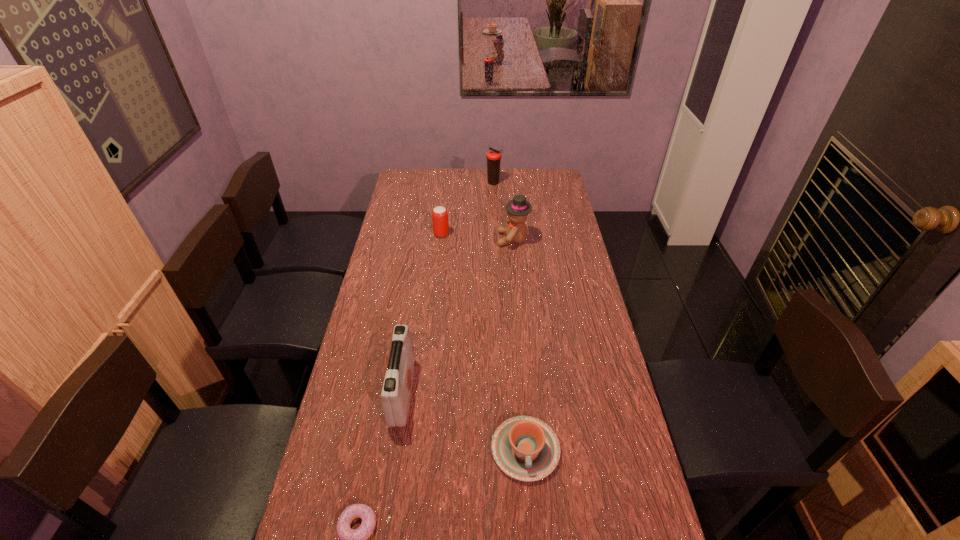
In order to click on rag_doll in this screenshot , I will do `click(518, 209)`.

You are a GUI agent. You are given a task and a screenshot of the screen. Output one action in this format:
    pyautogui.click(x=<x>, y=<y>)
    Task: Click on the farthest object
    Image resolution: width=960 pixels, height=540 pixels.
    Given the screenshot: What is the action you would take?
    pyautogui.click(x=493, y=157)

This screenshot has height=540, width=960. Identify the location of the first-aid kit. pyautogui.click(x=396, y=393).

Where is `beer can`? This screenshot has height=540, width=960. beer can is located at coordinates (439, 214).

Where is `the third shortest object`? The width and height of the screenshot is (960, 540). the third shortest object is located at coordinates (439, 214).

The image size is (960, 540). I want to click on the second shortest object, so click(525, 448).

Where is `free space located on the front-facing side of the rag_doll`? This screenshot has width=960, height=540. free space located on the front-facing side of the rag_doll is located at coordinates (409, 239).

You are a GUI agent. You are given a task and a screenshot of the screen. Output one action in this format:
    pyautogui.click(x=<x>, y=<y>)
    Task: Click on the free space located 0.240m on the front-facing side of the rag_doll
    
    Given the screenshot: What is the action you would take?
    pyautogui.click(x=442, y=239)

Locate an element on the screen. vacant position located on the front-facing side of the rag_doll is located at coordinates (442, 239).

The image size is (960, 540). In order to click on free space located on the left of the thermos bottle in this screenshot , I will do `click(408, 183)`.